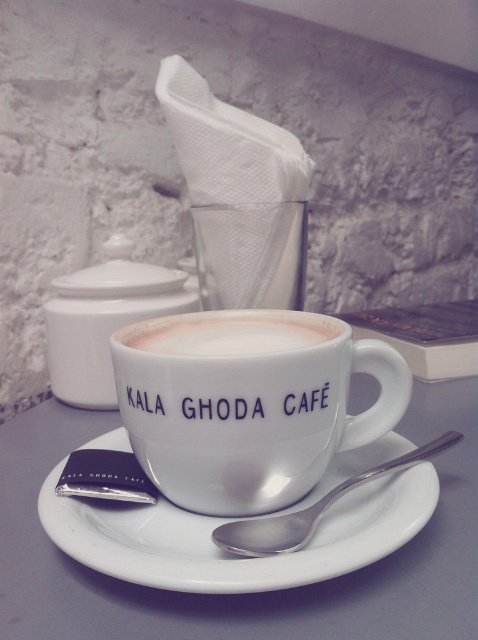
Is white ceramic cup at center to the right of foamy white coffee at center from the viewer's perspective?

Yes, white ceramic cup at center is to the right of foamy white coffee at center.

In the scene shown: Is white ceramic cup at center thinner than foamy white coffee at center?

No.

Who is more distant from viewer, (216,324) or (225,316)?

The point (225,316) is more distant.

Locate an element on the screen. This screenshot has width=478, height=640. white ceramic cup at center is located at coordinates (249, 404).

Between point (197, 577) and point (137, 339), which one is positioned behind?

Point (137, 339)

Which of these two, white ceramic saucer at center or foamy white coffee at center, stands taller?

white ceramic saucer at center is taller.

Where is `white ceramic saucer at center`? white ceramic saucer at center is located at coordinates (229, 520).

Does foamy white coffee at center have a greater height compared to satin silver spoon at center?

Incorrect, foamy white coffee at center's height is not larger of satin silver spoon at center's.

Who is positioned more to the left, foamy white coffee at center or satin silver spoon at center?

Positioned to the left is foamy white coffee at center.

Locate an element on the screen. foamy white coffee at center is located at coordinates (232, 333).